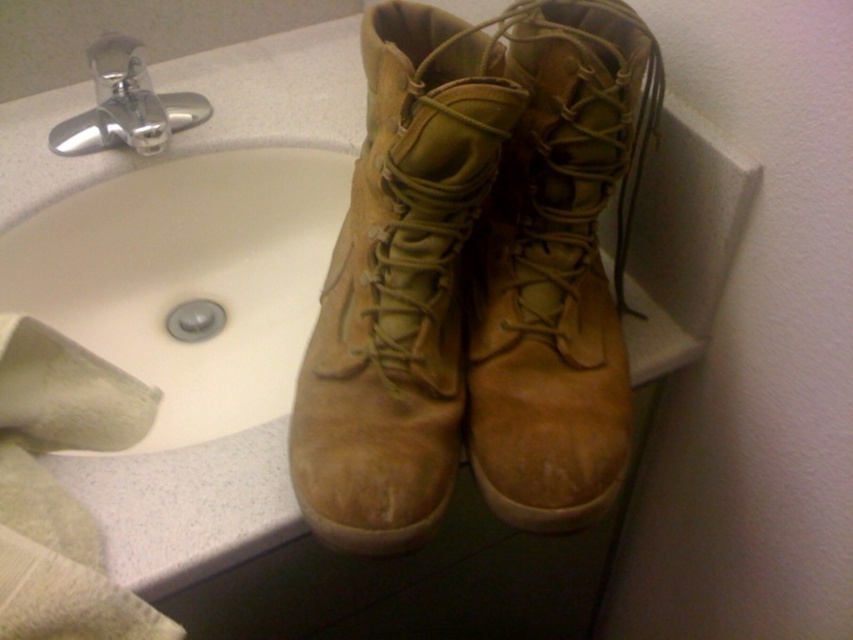
Can you confirm if tan suede boot at center is positioned below tan suede boot at upper right?

No.

Measure the distance from tan suede boot at center to tan suede boot at upper right.

tan suede boot at center is 2.65 inches away from tan suede boot at upper right.

Does point (392, 186) come in front of point (485, 230)?

Yes, it is.

Find the location of a particular element. The image size is (853, 640). tan suede boot at center is located at coordinates (399, 284).

Which of these two, tan suede boot at upper right or silver metallic faucet at upper left, stands taller?

With more height is tan suede boot at upper right.

Between point (624, 138) and point (90, 60), which one is positioned in front?

Positioned in front is point (624, 138).

Measure the distance between point (627, 54) and camera.

A distance of 20.05 inches exists between point (627, 54) and camera.

Where is `tan suede boot at upper right`? tan suede boot at upper right is located at coordinates (556, 266).

Does tan suede boot at center have a larger size compared to silver metallic faucet at upper left?

Indeed, tan suede boot at center has a larger size compared to silver metallic faucet at upper left.

Is point (409, 390) more distant than point (165, 100)?

That is False.

This screenshot has height=640, width=853. I want to click on tan suede boot at center, so click(399, 284).

Identify the location of tan suede boot at center. (399, 284).